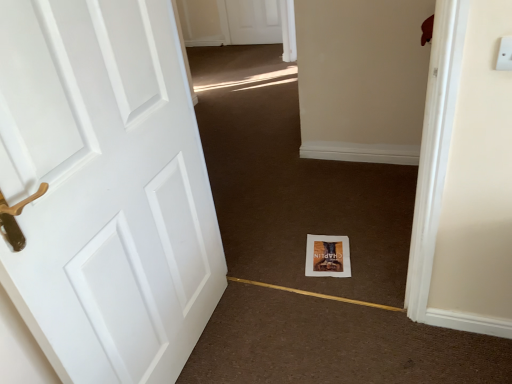
Question: Is white plastic electric outlet at upper right inside the boundaries of matte paper book at center, or outside?

Choices:
 (A) inside
 (B) outside

Answer: (B)

Question: Considering the positions of point (503, 39) and point (345, 251), is point (503, 39) closer or farther from the camera than point (345, 251)?

Choices:
 (A) closer
 (B) farther

Answer: (A)

Question: Which of these objects is positioned closest to the matte paper book at center?

Choices:
 (A) white paper at center
 (B) white plastic electric outlet at upper right
 (C) white matte door at left

Answer: (A)

Question: Estimate the real-world distances between objects in this image. Which object is closer to the white matte door at left?

Choices:
 (A) white paper at center
 (B) white plastic electric outlet at upper right
 (C) matte paper book at center

Answer: (C)